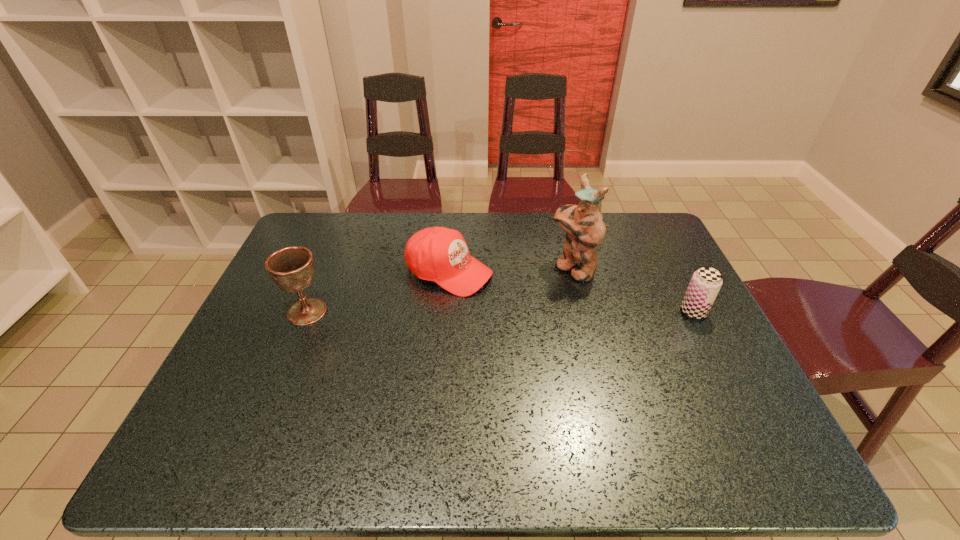
Locate an element on the screen. The height and width of the screenshot is (540, 960). vacant space on the desktop that is between the second tallest object and the beer can and is positioned on the front-facing side of the third object from left to right is located at coordinates pyautogui.click(x=498, y=312).

Identify the location of vacant space on the desktop that is between the leftmost object and the beer can and is positioned on the front panel of the second object from left to right. This screenshot has height=540, width=960. point(545,312).